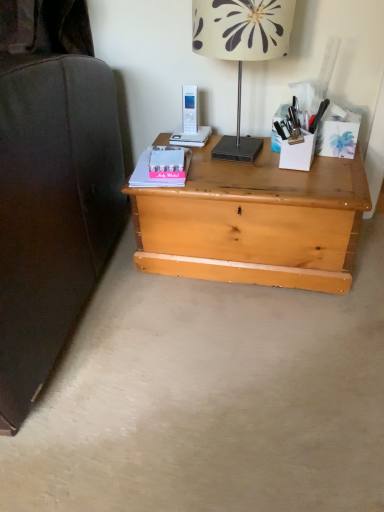
Where is `free space in front of white plastic phone at upper center`? Image resolution: width=384 pixels, height=512 pixels. free space in front of white plastic phone at upper center is located at coordinates (221, 165).